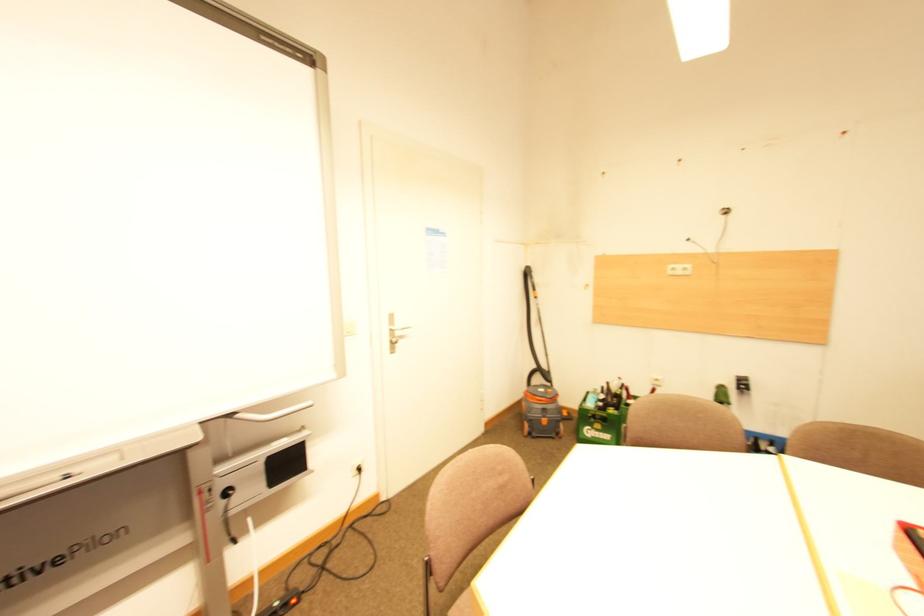
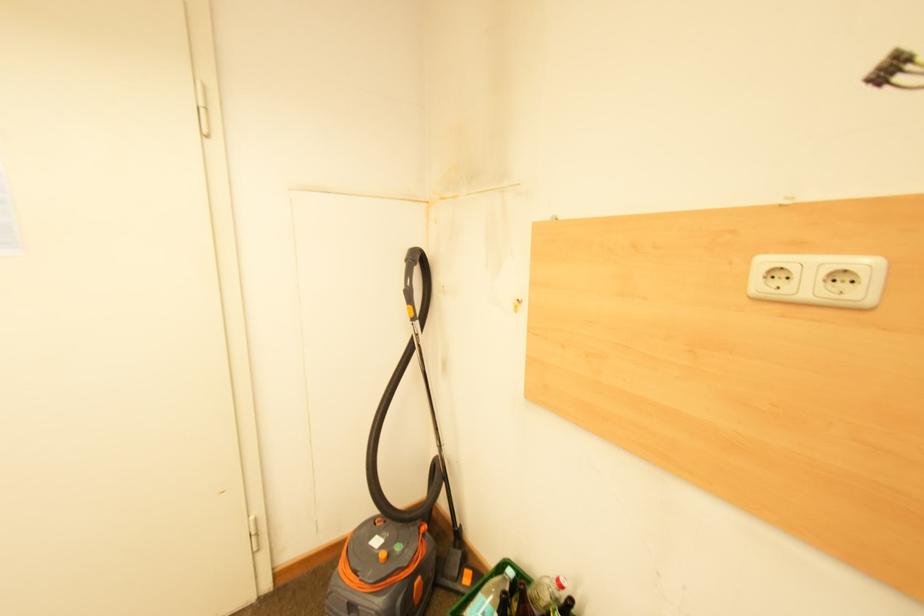
What movement of the cameraman would produce the second image?

The cameraman walked toward right, forward.